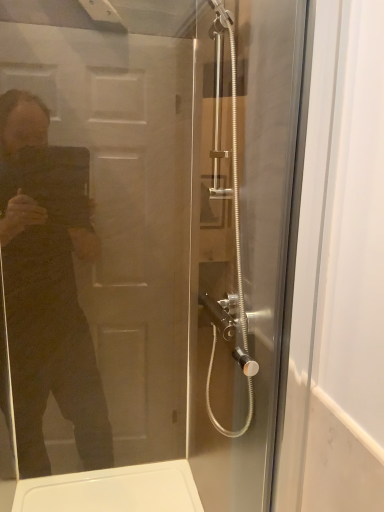
Question: Is point (288, 132) closer or farther from the camera than point (14, 358)?

Choices:
 (A) farther
 (B) closer

Answer: (B)

Question: Is clear glass shower door at center, the 1th screen door positioned from the back, inside the boundaries of clear glass shower door at center, the 2th screen door when ordered from back to front, or outside?

Choices:
 (A) inside
 (B) outside

Answer: (B)

Question: Based on their positions, is clear glass shower door at center, the 1th screen door positioned from the back, located to the left or right of clear glass shower door at center, acting as the 1th screen door starting from the front?

Choices:
 (A) left
 (B) right

Answer: (B)

Question: From the image's perspective, relative to clear glass shower door at center, the 1th screen door positioned from the back, is clear glass shower door at center, the 2th screen door when ordered from back to front, above or below?

Choices:
 (A) above
 (B) below

Answer: (B)

Question: In terms of height, does clear glass shower door at center, the 2th screen door when ordered from back to front, look taller or shorter compared to clear glass shower door at center, which appears as the second screen door when viewed from the front?

Choices:
 (A) short
 (B) tall

Answer: (A)

Question: Does point (142, 67) appear closer or farther from the camera than point (205, 432)?

Choices:
 (A) closer
 (B) farther

Answer: (A)

Question: Is clear glass shower door at center, acting as the 1th screen door starting from the front, inside the boundaries of clear glass shower door at center, the 1th screen door positioned from the back, or outside?

Choices:
 (A) inside
 (B) outside

Answer: (B)